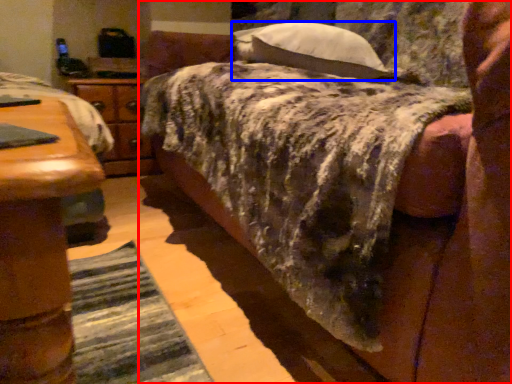
Question: Which object appears farthest to the camera in this image, bed (highlighted by a red box) or pillow (highlighted by a blue box)?

Choices:
 (A) bed
 (B) pillow

Answer: (B)